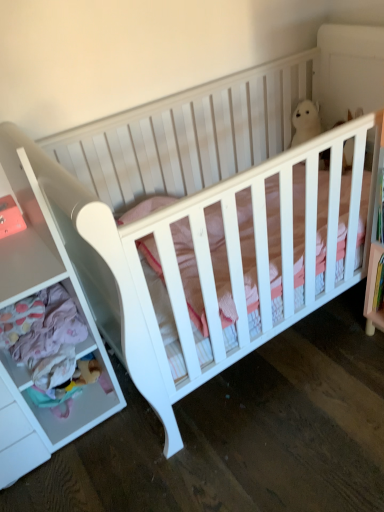
Locate an element on the screen. The height and width of the screenshot is (512, 384). free space in front of soft plush bear at lower left is located at coordinates pyautogui.click(x=79, y=447).